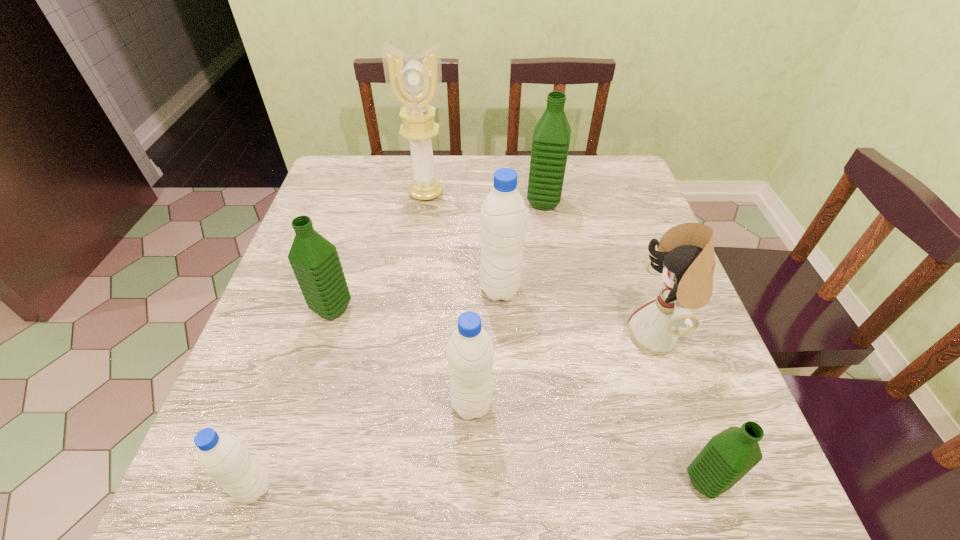
Locate an element on the screen. the smallest gray water bottle is located at coordinates (222, 456).

Find the location of a particular element. This screenshot has height=540, width=960. the leftmost gray water bottle is located at coordinates (222, 456).

Identify the location of the nearest green water bottle. (728, 456).

The height and width of the screenshot is (540, 960). I want to click on the rightmost green water bottle, so click(728, 456).

Locate an element on the screen. vacant space located 0.080m on the front-facing side of the sixth object from right to left is located at coordinates (421, 222).

I want to click on vacant position located on the left of the farthest green water bottle, so click(x=452, y=203).

The width and height of the screenshot is (960, 540). I want to click on vacant region located 0.180m on the back of the farthest gray water bottle, so 497,225.

Identify the location of free space located at the front face of the doll. (436, 336).

Image resolution: width=960 pixels, height=540 pixels. I want to click on vacant space situated 0.400m at the front face of the doll, so click(431, 336).

Image resolution: width=960 pixels, height=540 pixels. Find the location of `vacant space located 0.350m at the front face of the doll`. vacant space located 0.350m at the front face of the doll is located at coordinates tap(456, 336).